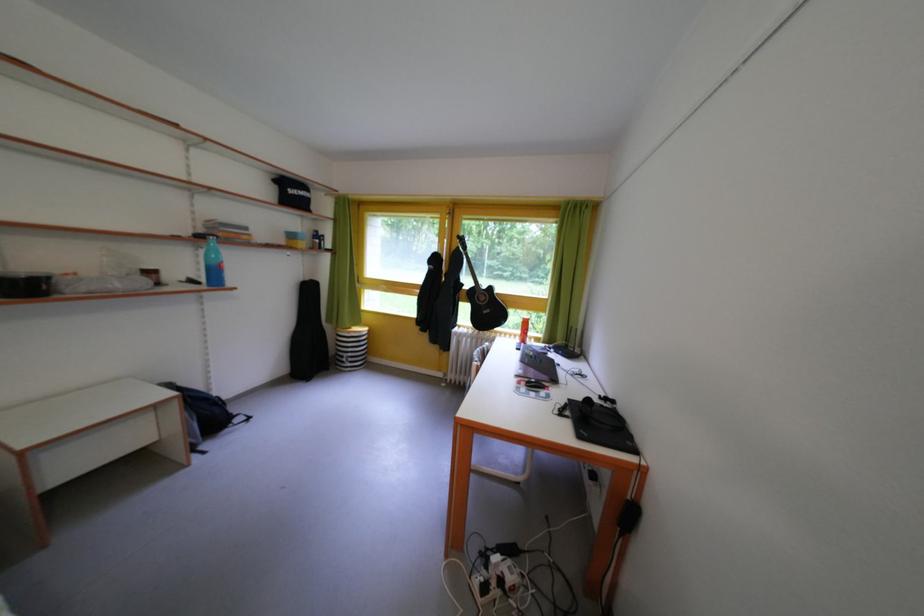
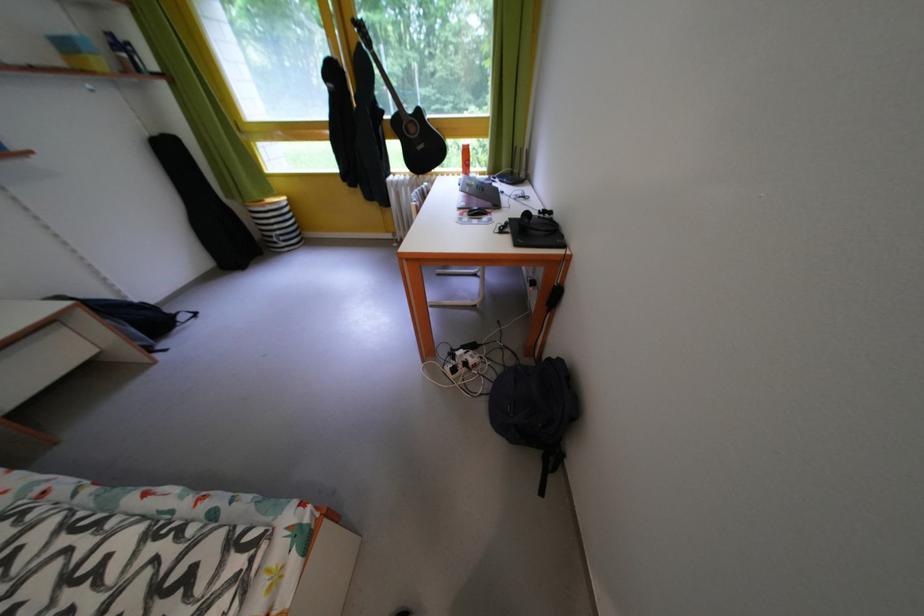
Question: I am providing you with two images of the same scene from different viewpoints. Which of the following objects are not visible in image2?

Choices:
 (A) red bottle
 (B) black bag
 (C) black control knob
 (D) none of these

Answer: (D)